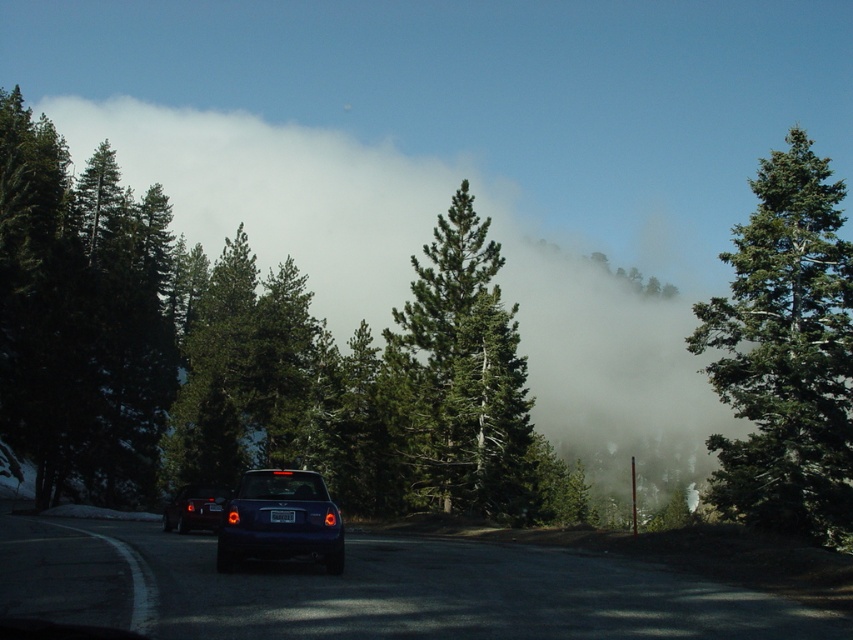
You are driving a car and see the glossy blue car at center and the white foggy cloud at upper center in your view. Which object is closer to you?

The white foggy cloud at upper center is closer to you because the glossy blue car at center is behind it.

You are a driver approaching the glossy blue car at center and the black plastic license plate at center. Which object is closer to your current position?

The glossy blue car at center is closer to your current position because it is positioned to the left of the black plastic license plate at center, which is further away.

You are driving a car and see the image. There is a green matte tree at right and a glossy black car at lower left. Which object is bigger in the scene?

The green matte tree at right is larger than the glossy black car at lower left.